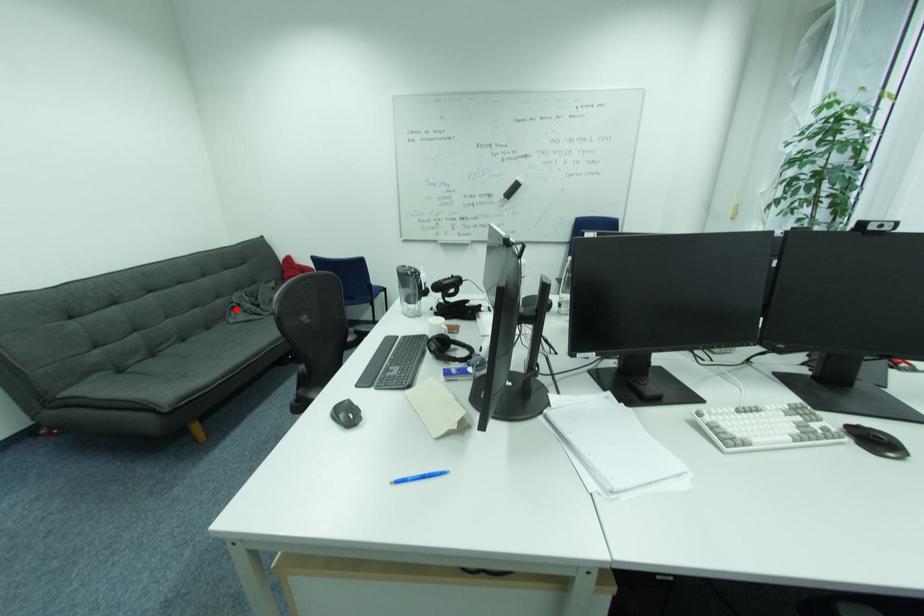
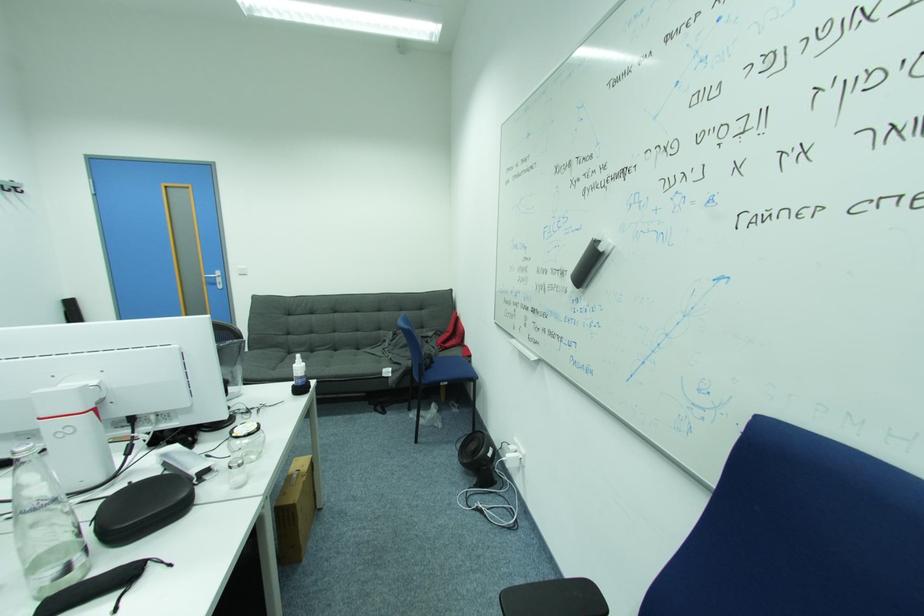
In the second image, find the point that corresponds to the highlighted location in the first image.

(388, 341)